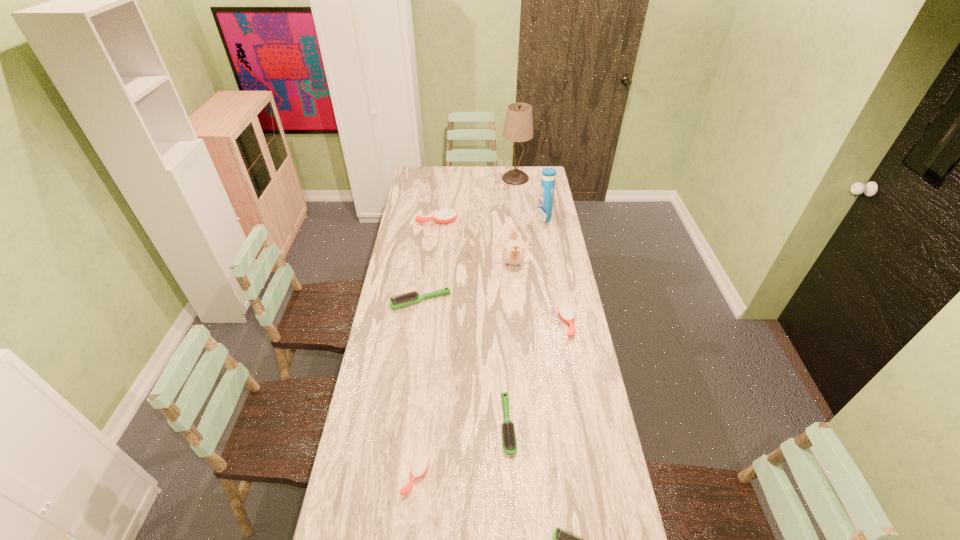
Where is `free space between the fourth farthest object and the detergent`? The height and width of the screenshot is (540, 960). free space between the fourth farthest object and the detergent is located at coordinates (528, 242).

The width and height of the screenshot is (960, 540). In order to click on free spot between the second biggest orange hairbrush and the biggest light hairbrush in this screenshot , I will do `click(494, 312)`.

Find the location of `the closest object to the third tallest object`. the closest object to the third tallest object is located at coordinates click(x=410, y=298).

In order to click on the eighth closest object relative to the white bird in this screenshot , I will do `click(561, 539)`.

Identify which hairbrush is the third nearest to the bird. Please provide its 2D coordinates. Your answer should be formatted as a tuple, i.e. [(x, y)], where the tuple contains the x and y coordinates of a point satisfying the conditions above.

[(446, 215)]

Locate an element on the screen. This screenshot has width=960, height=540. hairbrush that can be found as the second closest to the fifth farthest hairbrush is located at coordinates (561, 539).

Find the location of a particular element. the closest orange hairbrush to the rightmost orange hairbrush is located at coordinates (420, 465).

Identify which orange hairbrush is located as the second nearest to the eighth shortest object. Please provide its 2D coordinates. Your answer should be formatted as a tuple, i.e. [(x, y)], where the tuple contains the x and y coordinates of a point satisfying the conditions above.

[(566, 312)]

Image resolution: width=960 pixels, height=540 pixels. What are the coordinates of `the second closest light hairbrush to the farthest light hairbrush` in the screenshot? It's located at (561, 539).

Locate an element on the screen. Image resolution: width=960 pixels, height=540 pixels. light hairbrush that is the third closest to the eighth shortest object is located at coordinates (561, 539).